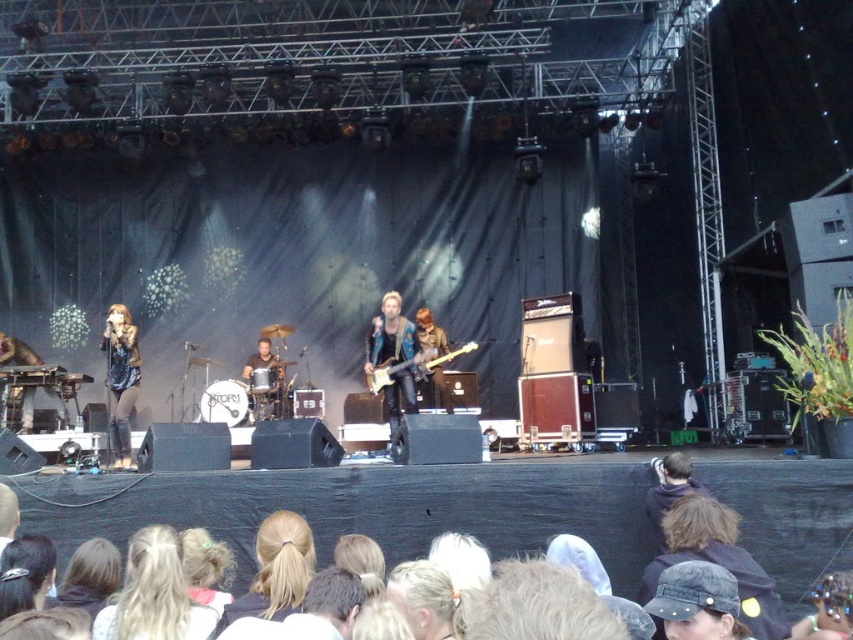
You are a photographer at the concert venue. You want to capture a closeup shot of the singer and the guitarist. Given that your camera can only focus on objects within a 1 meter range, can you determine if the blonde hair at center and the shiny blue jacket at center are within the focus range based on their sizes?

The blonde hair at center is smaller than the shiny blue jacket at center, which suggests that the distance between them might be within the 1 meter range. However, size alone cannot definitively determine distance. Other factors like their actual positions on the stage and the camera lens settings are needed for an accurate assessment.

You are a photographer at the concert and want to capture a shot of both the blonde hair at center and the shiny blue jacket at center. Based on their positions, which one should you focus on first to ensure both are in frame?

Since the blonde hair at center is to the left of the shiny blue jacket at center, you should focus on the shiny blue jacket at center first to ensure both are in frame.

You are a photographer at the concert and want to capture a closeup of the denim cap at lower right and the glossy electric guitar at center. Which object should you focus on first if you want to ensure both are in focus without adjusting the camera settings?

The denim cap at lower right is below the glossy electric guitar at center, so you should focus on the glossy electric guitar at center first since it is closer to the camera. This way, the depth of field will likely include the denim cap at lower right in focus as well.